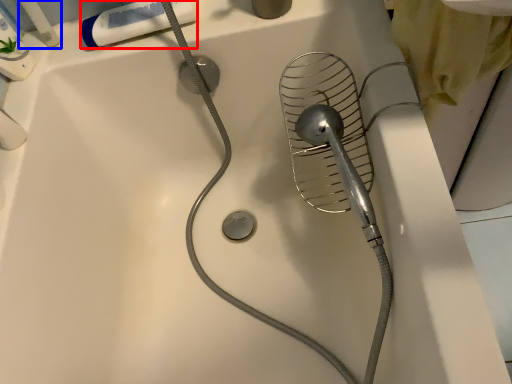
Question: Which point is closer to the camera, toothpaste (highlighted by a red box) or toiletry (highlighted by a blue box)?

Choices:
 (A) toothpaste
 (B) toiletry

Answer: (B)